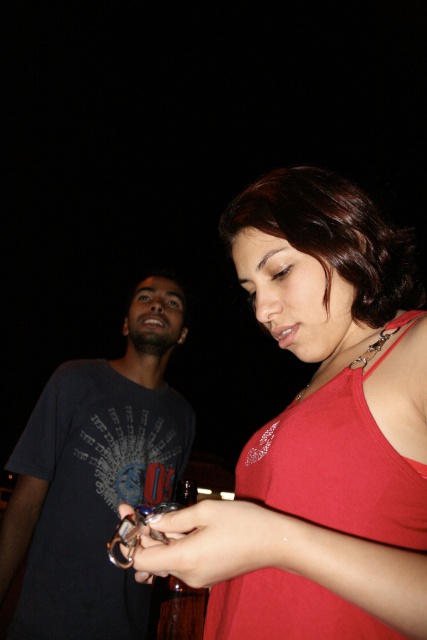
You are standing at the point with coordinates point (70, 548) and want to move to the point with coordinates point (210, 552). Given the scene described, is there any obstruction between your current position and the destination?

Yes, there is an obstruction between point (70, 548) and point (210, 552) because the woman and the man are positioned in between these points.